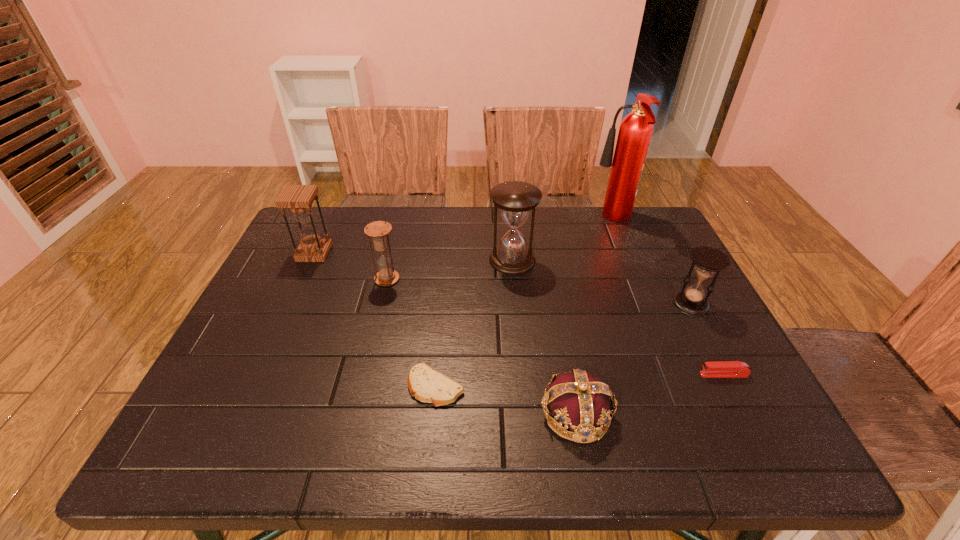
Find the location of a particular element. The width and height of the screenshot is (960, 540). vacant area that lies between the seventh tallest object and the nearest hourglass is located at coordinates (708, 339).

Find the location of a particular element. free space between the fire extinguisher and the third hourglass from left to right is located at coordinates (563, 240).

Identify the location of vacant space that is in between the leftmost hourglass and the third object from left to right. This screenshot has height=540, width=960. pos(375,320).

Image resolution: width=960 pixels, height=540 pixels. I want to click on vacant area that lies between the fifth farthest object and the leftmost object, so click(x=502, y=279).

This screenshot has height=540, width=960. What are the coordinates of `free spot between the leftmost object and the farthest object` in the screenshot? It's located at click(x=464, y=237).

Locate an element on the screen. Image resolution: width=960 pixels, height=540 pixels. free point between the leftmost object and the tallest object is located at coordinates (464, 237).

Identify the location of empty space between the stapler and the second hourglass from right to left. This screenshot has width=960, height=540. (618, 317).

What are the coordinates of `object that stands as the sixth closest to the nearest hourglass` in the screenshot? It's located at (378, 230).

Where is `object that is the third closest one to the fire extinguisher`? object that is the third closest one to the fire extinguisher is located at coordinates (716, 369).

What are the coordinates of `hourglass identified as the second closest to the crown` in the screenshot? It's located at pos(516,199).